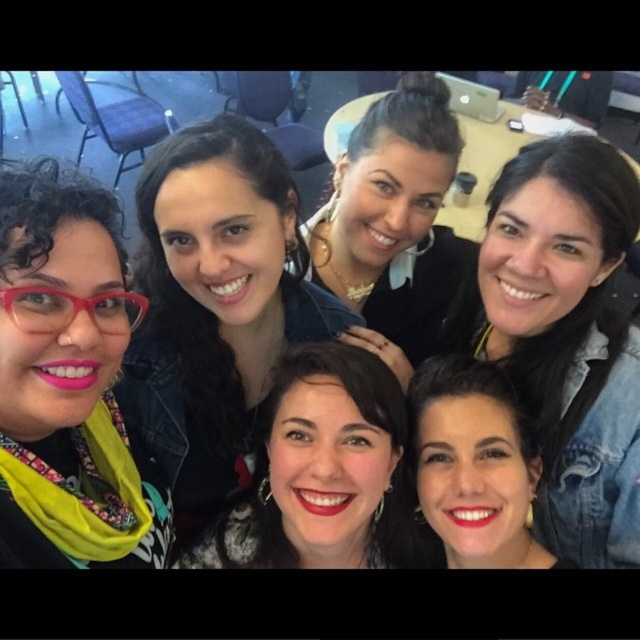
You are trying to decide which object is larger between the matte black jacket at upper left and the matte black hair at center. Based on the scene description, which one is bigger?

The matte black jacket at upper left is bigger than the matte black hair at center according to the description.